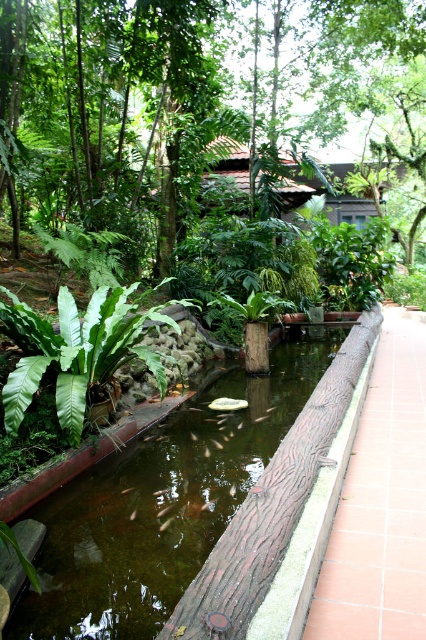
Based on the photo, you are standing at the entrance of the scene and want to locate the green leafy tree at center. According to the coordinates provided, where should you look to find it?

The green leafy tree at center is located at coordinates point (x=172, y=99), so you should look towards the lower left area of the scene to find it.